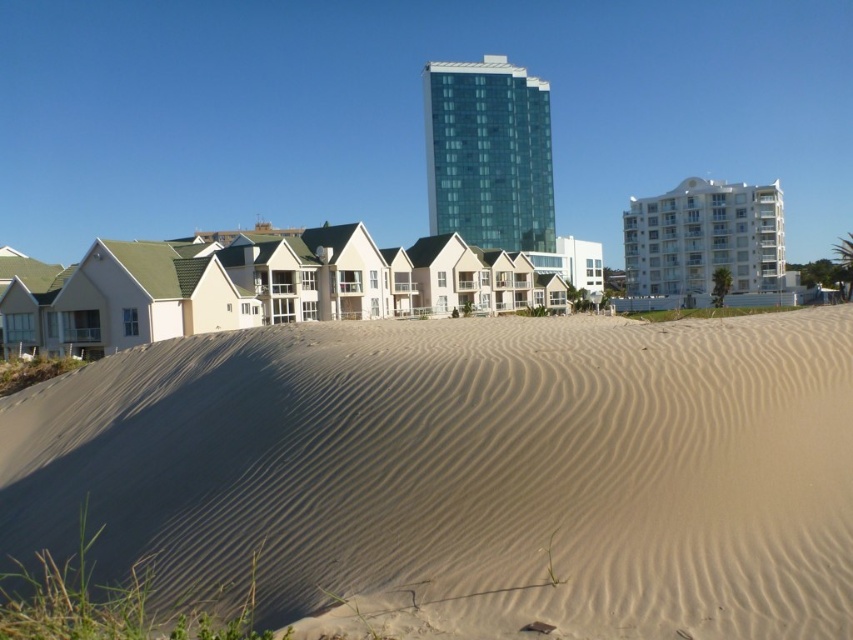
Question: Among these points, which one is nearest to the camera?

Choices:
 (A) (100, 387)
 (B) (485, 292)
 (C) (494, 72)
 (D) (740, 291)

Answer: (A)

Question: Is beige wood houses at center wider than green glass building at center?

Choices:
 (A) yes
 (B) no

Answer: (A)

Question: Is light beige sand at center above white glossy building at upper right?

Choices:
 (A) yes
 (B) no

Answer: (B)

Question: Which object is positioned farthest from the beige wood houses at center?

Choices:
 (A) light beige sand at center
 (B) green glass building at center
 (C) white glossy building at upper right

Answer: (B)

Question: Which object is the farthest from the white glossy building at upper right?

Choices:
 (A) light beige sand at center
 (B) beige wood houses at center
 (C) green glass building at center

Answer: (A)

Question: Can you confirm if beige wood houses at center is positioned above white glossy building at upper right?

Choices:
 (A) no
 (B) yes

Answer: (A)